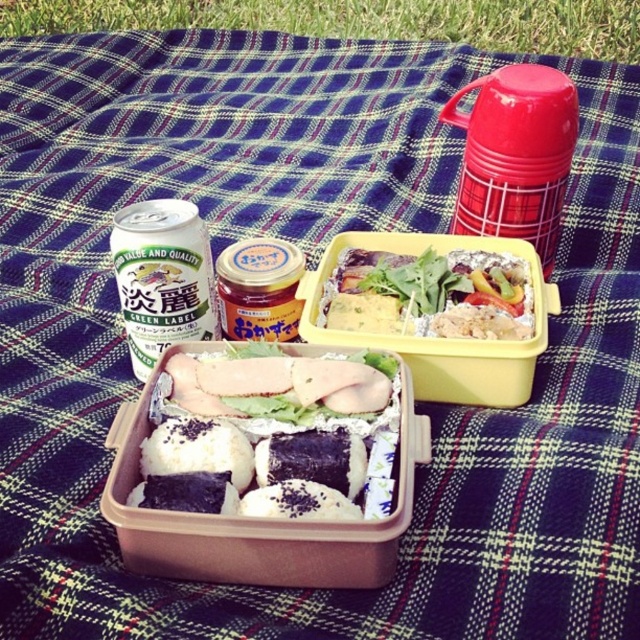
Question: Observing the image, what is the correct spatial positioning of vibrant mixed vegetables at center in reference to purple rice ball at center?

Choices:
 (A) left
 (B) right

Answer: (B)

Question: Which point is closer to the camera?

Choices:
 (A) (125, 234)
 (B) (324, 456)
 (C) (385, 486)
 (D) (454, 314)

Answer: (C)

Question: Is white rice with nori at center to the left of vibrant mixed vegetables at center from the viewer's perspective?

Choices:
 (A) yes
 (B) no

Answer: (A)

Question: Is vibrant mixed vegetables at center below green label can at left?

Choices:
 (A) yes
 (B) no

Answer: (B)

Question: Which point is closer to the camera taking this photo?

Choices:
 (A) (486, 256)
 (B) (244, 497)
 (C) (301, 438)

Answer: (B)

Question: Among these points, which one is farthest from the camera?

Choices:
 (A) (387, 268)
 (B) (308, 429)
 (C) (138, 272)
 (D) (241, 365)

Answer: (A)